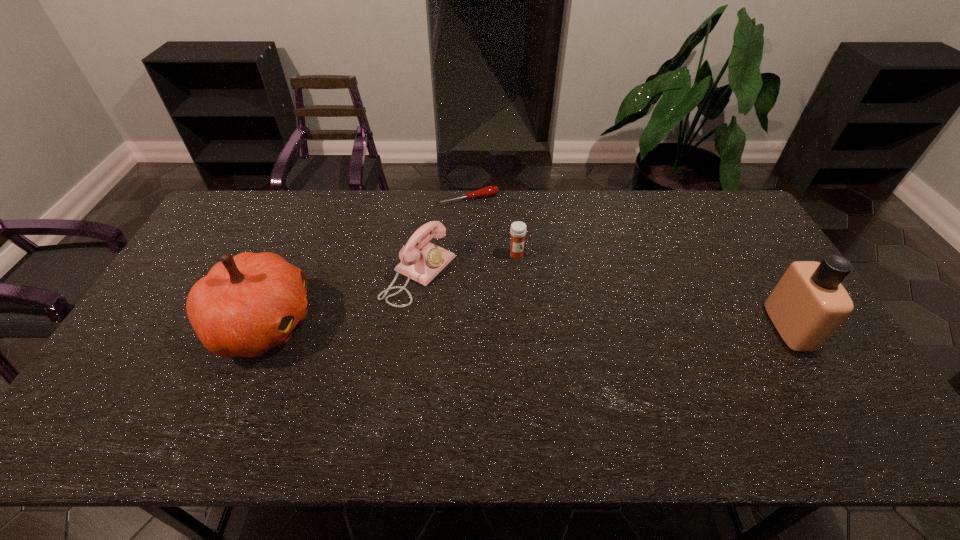
Find the location of a particular element. The width and height of the screenshot is (960, 540). free space between the rightmost object and the screwdriver is located at coordinates (629, 262).

Locate an element on the screen. free spot between the third shortest object and the medicine is located at coordinates tap(468, 265).

Identify which object is located as the third nearest to the telephone. Please provide its 2D coordinates. Your answer should be formatted as a tuple, i.e. [(x, y)], where the tuple contains the x and y coordinates of a point satisfying the conditions above.

[(488, 191)]

Point out which object is positioned as the nearest to the third tallest object. Please provide its 2D coordinates. Your answer should be formatted as a tuple, i.e. [(x, y)], where the tuple contains the x and y coordinates of a point satisfying the conditions above.

[(247, 304)]

Where is `vacant region that satisfies the following two spatial constraints: 1. on the front side of the rightmost object; 2. on the front label of the fourth tallest object`? vacant region that satisfies the following two spatial constraints: 1. on the front side of the rightmost object; 2. on the front label of the fourth tallest object is located at coordinates (522, 326).